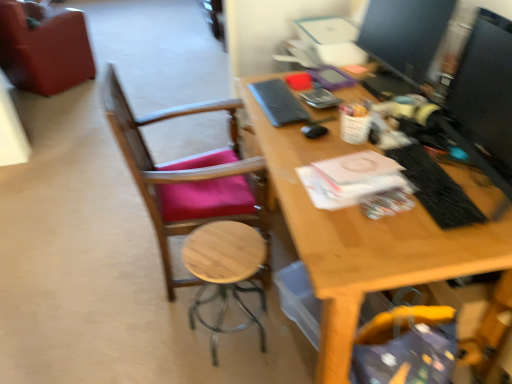
This screenshot has height=384, width=512. What are the coordinates of `vacant position to the left of wooden chair at left, acting as the second chair starting from the back` in the screenshot? It's located at (101, 268).